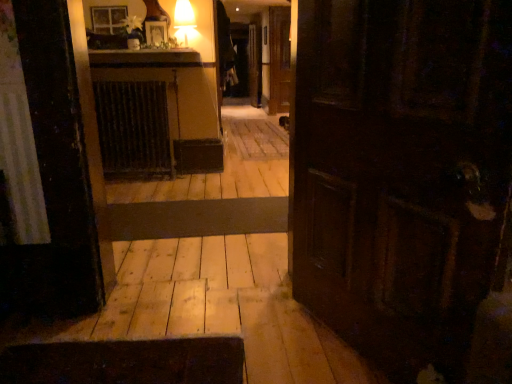
Measure the distance between point (205,358) and camera.

The distance of point (205,358) from camera is 1.66 meters.

This screenshot has width=512, height=384. What do you see at coordinates (127, 361) in the screenshot?
I see `wooden floor at center` at bounding box center [127, 361].

Find the location of a particular element. wooden floor at center is located at coordinates (127, 361).

Describe the element at coordinates (134, 129) in the screenshot. This screenshot has height=384, width=512. I see `dark brown metal radiator at center` at that location.

Locate an element on the screen. The height and width of the screenshot is (384, 512). dark brown metal radiator at center is located at coordinates (134, 129).

What is the approximate width of dark brown metal radiator at center?

The width of dark brown metal radiator at center is 27.02 centimeters.

This screenshot has width=512, height=384. Find the location of `wooden floor at center`. wooden floor at center is located at coordinates tap(127, 361).

Would you say wooden floor at center is to the left or to the right of dark brown metal radiator at center in the picture?

From the image, it's evident that wooden floor at center is to the right of dark brown metal radiator at center.

In the image, is wooden floor at center positioned in front of or behind dark brown metal radiator at center?

Visually, wooden floor at center is located in front of dark brown metal radiator at center.

Is point (182, 376) behind point (125, 139)?

No, (182, 376) is closer to viewer.

From the image's perspective, relative to dark brown metal radiator at center, is wooden floor at center above or below?

From the image's perspective, wooden floor at center appears below dark brown metal radiator at center.

From a real-world perspective, is wooden floor at center on top of dark brown metal radiator at center?

No, from a real-world perspective, wooden floor at center is not over dark brown metal radiator at center

Is wooden floor at center wider than dark brown metal radiator at center?

Yes, wooden floor at center is wider than dark brown metal radiator at center.

Considering the sizes of wooden floor at center and dark brown metal radiator at center in the image, is wooden floor at center taller or shorter than dark brown metal radiator at center?

In the image, wooden floor at center appears to be shorter than dark brown metal radiator at center.

Looking at this image, between wooden floor at center and dark brown metal radiator at center, which one has smaller size?

With smaller size is wooden floor at center.

Is wooden floor at center completely or partially outside of dark brown metal radiator at center?

Yes, wooden floor at center is located beyond the bounds of dark brown metal radiator at center.

Is wooden floor at center with dark brown metal radiator at center?

wooden floor at center and dark brown metal radiator at center are clearly separated.

Is wooden floor at center facing towards dark brown metal radiator at center?

No, wooden floor at center is not facing towards dark brown metal radiator at center.

Where is `radiator above the wooden floor at center (from the image's perspective)`? The width and height of the screenshot is (512, 384). radiator above the wooden floor at center (from the image's perspective) is located at coordinates (134, 129).

Can you confirm if dark brown metal radiator at center is positioned to the left of wooden floor at center?

Yes, dark brown metal radiator at center is to the left of wooden floor at center.

From the picture: Is the depth of dark brown metal radiator at center greater than that of wooden floor at center?

Yes, dark brown metal radiator at center is further from the camera.

Is point (155, 156) closer to viewer compared to point (82, 354)?

That is False.

From the picture: From the image's perspective, which object appears higher, dark brown metal radiator at center or wooden floor at center?

dark brown metal radiator at center is shown above in the image.

Consider the image. From a real-world perspective, is dark brown metal radiator at center located higher than wooden floor at center?

Correct, in the physical world, dark brown metal radiator at center is higher than wooden floor at center.

Is dark brown metal radiator at center wider than wooden floor at center?

Incorrect, the width of dark brown metal radiator at center does not surpass that of wooden floor at center.

Can you confirm if dark brown metal radiator at center is taller than wooden floor at center?

Correct, dark brown metal radiator at center is much taller as wooden floor at center.

Can you confirm if dark brown metal radiator at center is smaller than wooden floor at center?

Actually, dark brown metal radiator at center might be larger than wooden floor at center.

Is dark brown metal radiator at center not inside wooden floor at center?

Absolutely, dark brown metal radiator at center is external to wooden floor at center.

Is dark brown metal radiator at center not close to wooden floor at center?

Yes, dark brown metal radiator at center and wooden floor at center are located far from each other.

Is wooden floor at center at the back of dark brown metal radiator at center?

No, dark brown metal radiator at center's orientation is not away from wooden floor at center.

Locate an element on the screen. Image resolution: width=512 pixels, height=384 pixels. radiator that appears on the left of wooden floor at center is located at coordinates (134, 129).

The width and height of the screenshot is (512, 384). In the image, there is a wooden floor at center. What are the coordinates of `radiator above it (from the image's perspective)` in the screenshot? It's located at pyautogui.click(x=134, y=129).

At what (x,y) coordinates should I click in order to perform the action: click on stairwell below the dark brown metal radiator at center (from the image's perspective). Please return your answer as a coordinate pair (x, y). Image resolution: width=512 pixels, height=384 pixels. Looking at the image, I should click on (127, 361).